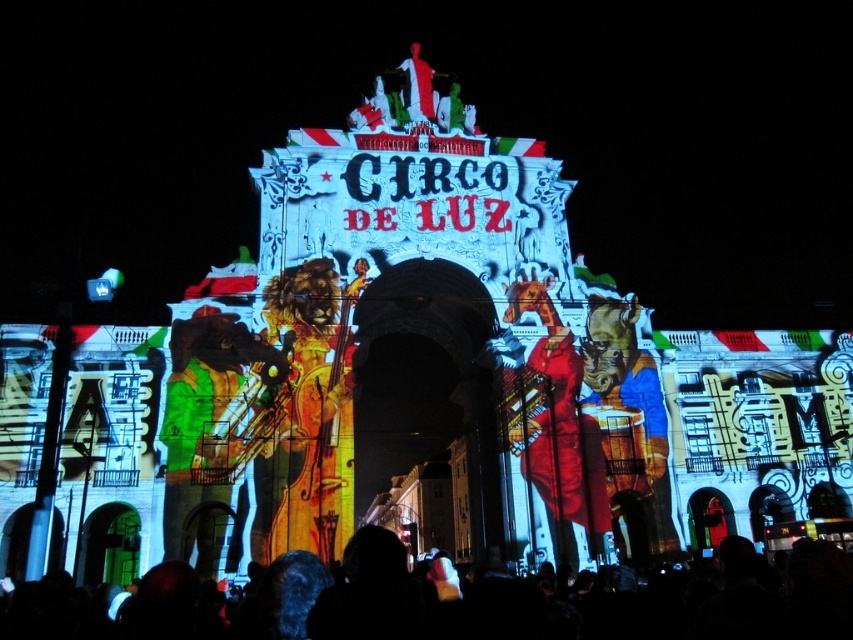
You are a photographer standing in front of the building. You want to take a photo that includes both the black matte crowd at lower center and the shiny gold violin at center. Which object should you focus on first to ensure both are in frame?

The black matte crowd at lower center is located below the shiny gold violin at center. To include both in the frame, focus on the shiny gold violin at center first as it is higher up, then adjust the camera angle downward to include the black matte crowd at lower center below it.

You are attending the CIRCO DE LUZ event and notice two performers on the building projection. The shiny gold violin at center and the green fabric musician at center. Which performer appears bigger in the projection?

The shiny gold violin at center appears larger in the projection compared to the green fabric musician at center.

In the nighttime scene with the building projection showing a violinist and other characters, there is a point labeled at coordinates (546, 600). Based on the image description, where is this point located in relation to the black matte crowd at lower center?

The point labeled at coordinates (546, 600) is located on the black matte crowd at lower center.